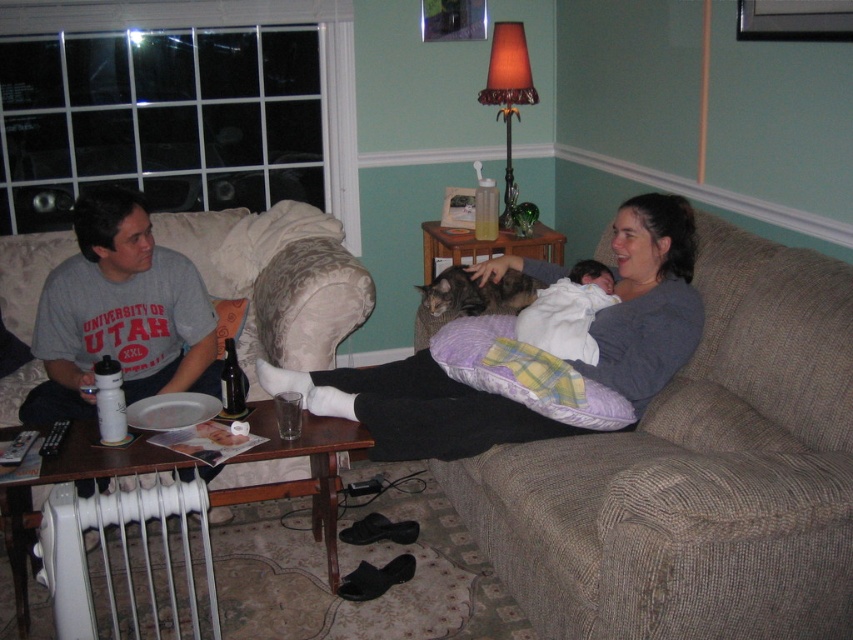
Question: Which of the following is the closest to the observer?

Choices:
 (A) gray soft fabric woman at center
 (B) gray cotton t-shirt at left
 (C) gray fur cat at center

Answer: (A)

Question: Does gray cotton t-shirt at left have a larger size compared to orange fabric lampshade at upper center?

Choices:
 (A) yes
 (B) no

Answer: (A)

Question: Does beige fabric couch at center lie in front of gray fur cat at center?

Choices:
 (A) no
 (B) yes

Answer: (B)

Question: Which of the following is the closest to the observer?

Choices:
 (A) beige fabric couch at center
 (B) white soft baby at center
 (C) gray soft fabric woman at center

Answer: (A)

Question: Which object is closer to the camera taking this photo?

Choices:
 (A) gray soft fabric woman at center
 (B) dark glass bottle at center
 (C) gray fur cat at center

Answer: (A)

Question: Is gray soft fabric woman at center positioned in front of dark glass bottle at center?

Choices:
 (A) yes
 (B) no

Answer: (A)